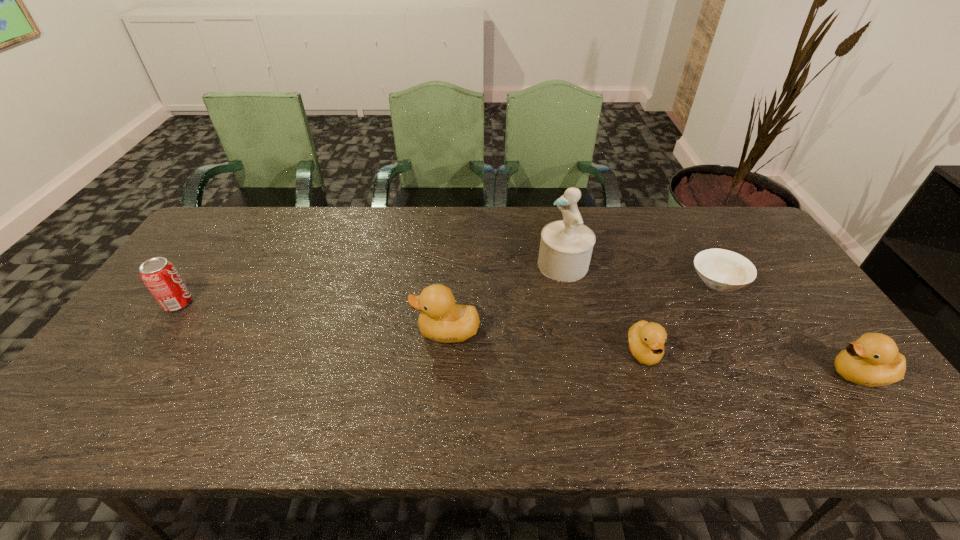
The width and height of the screenshot is (960, 540). What are the coordinates of `vacant region located facing forward on the second object from left to right` in the screenshot? It's located at (303, 332).

The width and height of the screenshot is (960, 540). What are the coordinates of `free point located 0.080m facing forward on the second object from left to right` in the screenshot? It's located at (383, 332).

At what (x,y) coordinates should I click in order to perform the action: click on vacant area situated facing forward on the second object from left to right. Please return your answer as a coordinate pair (x, y). The width and height of the screenshot is (960, 540). Looking at the image, I should click on (391, 332).

Where is `vacant space situated 0.070m facing forward on the rightmost object`? vacant space situated 0.070m facing forward on the rightmost object is located at coordinates (799, 375).

Find the location of a particular element. This screenshot has height=540, width=960. free spot located facing forward on the rightmost object is located at coordinates (665, 375).

You are a GUI agent. You are given a task and a screenshot of the screen. Output one action in this format:
    pyautogui.click(x=<x>, y=<y>)
    Task: Click on the free space located 0.240m facing forward on the rightmost object
    This screenshot has height=540, width=960.
    Given the screenshot: What is the action you would take?
    pyautogui.click(x=728, y=375)

Image resolution: width=960 pixels, height=540 pixels. I want to click on free space located at the beak of the figurine, so click(414, 265).

You are a GUI agent. You are given a task and a screenshot of the screen. Output one action in this format:
    pyautogui.click(x=<x>, y=<y>)
    Task: Click on the free space located 0.120m at the beak of the figurine
    
    Given the screenshot: What is the action you would take?
    pyautogui.click(x=498, y=265)

The height and width of the screenshot is (540, 960). I want to click on free space located at the beak of the figurine, so click(423, 265).

Identify the location of free space located on the front of the leftmost object. (144, 352).